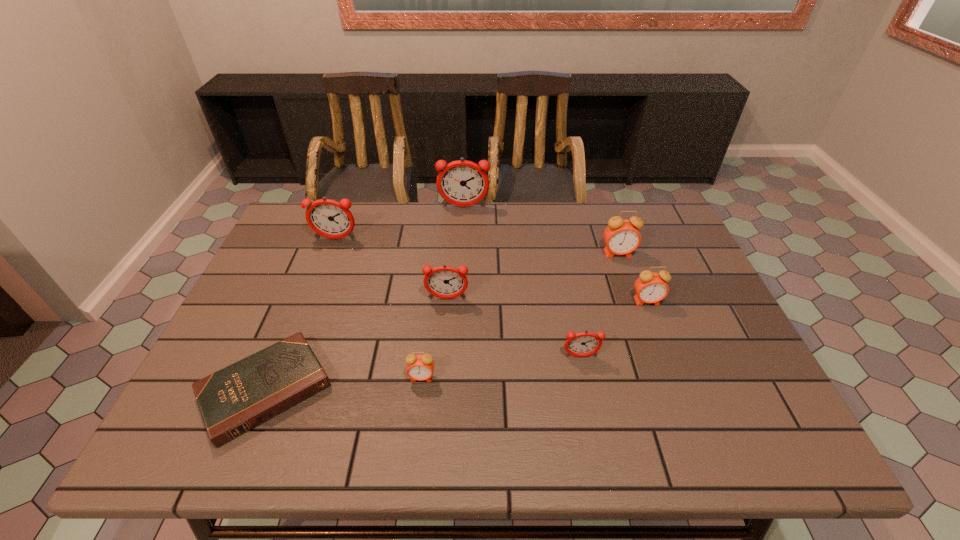
Find the location of a particular element. The height and width of the screenshot is (540, 960). free region located on the face of the smallest pink alarm clock is located at coordinates (417, 420).

Where is `vacant space located on the right of the Bible`? The height and width of the screenshot is (540, 960). vacant space located on the right of the Bible is located at coordinates (358, 390).

The width and height of the screenshot is (960, 540). Find the location of `object that is positioned at the near edge`. object that is positioned at the near edge is located at coordinates (236, 399).

Where is `alarm clock located in the left edge section of the desktop`? Image resolution: width=960 pixels, height=540 pixels. alarm clock located in the left edge section of the desktop is located at coordinates (328, 218).

Where is `Bible located in the left edge section of the desktop`? Bible located in the left edge section of the desktop is located at coordinates (236, 399).

What are the coordinates of `object that is at the right edge` in the screenshot? It's located at (650, 287).

Where is `object located in the far left corner section of the desktop`? object located in the far left corner section of the desktop is located at coordinates (328, 218).

Find the location of a particular element. The height and width of the screenshot is (540, 960). object that is at the near left corner is located at coordinates (236, 399).

The image size is (960, 540). Identify the location of vacant space at the far edge. (350, 242).

Locate an element on the screen. The width and height of the screenshot is (960, 540). vacant point at the near edge is located at coordinates (393, 451).